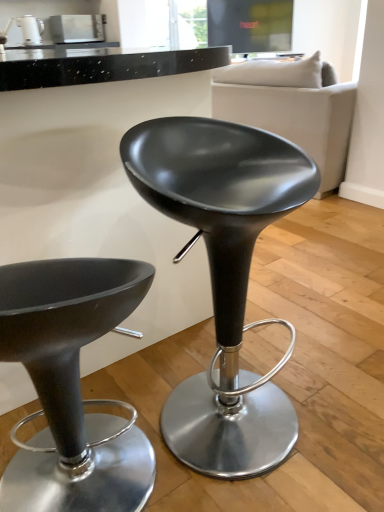
The width and height of the screenshot is (384, 512). Find the location of `vacant point above matte white kettle at upper left, the first appliance viewed from the left (from a real-world perspective)`. vacant point above matte white kettle at upper left, the first appliance viewed from the left (from a real-world perspective) is located at coordinates click(x=28, y=11).